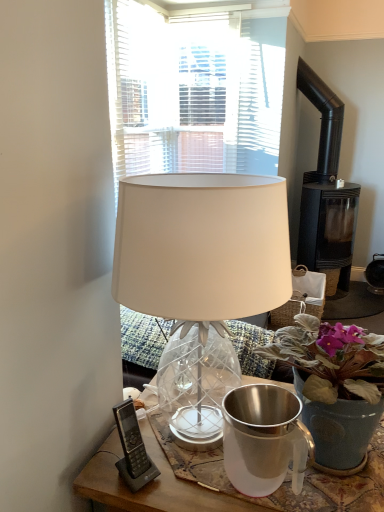
Question: Is black matte fireplace at right placed right next to white glass lamp at center?

Choices:
 (A) yes
 (B) no

Answer: (B)

Question: Is black matte fireplace at right positioned far away from white glass lamp at center?

Choices:
 (A) yes
 (B) no

Answer: (A)

Question: Is black matte fireplace at right facing towards white glass lamp at center?

Choices:
 (A) yes
 (B) no

Answer: (A)

Question: Is black matte fireplace at right positioned with its back to white glass lamp at center?

Choices:
 (A) no
 (B) yes

Answer: (A)

Question: Does black matte fireplace at right lie in front of white glass lamp at center?

Choices:
 (A) no
 (B) yes

Answer: (A)

Question: From a real-world perspective, is black matte fireplace at right on top of white glass lamp at center?

Choices:
 (A) yes
 (B) no

Answer: (B)

Question: Would you say shiny metallic jug at center is outside white glass lamp at center?

Choices:
 (A) yes
 (B) no

Answer: (B)

Question: From a real-world perspective, is shiny metallic jug at center positioned under white glass lamp at center based on gravity?

Choices:
 (A) yes
 (B) no

Answer: (A)

Question: Is the position of shiny metallic jug at center less distant than that of white glass lamp at center?

Choices:
 (A) no
 (B) yes

Answer: (A)

Question: Considering the relative positions of shiny metallic jug at center and white glass lamp at center in the image provided, is shiny metallic jug at center to the right of white glass lamp at center from the viewer's perspective?

Choices:
 (A) yes
 (B) no

Answer: (A)

Question: Does shiny metallic jug at center appear on the left side of white glass lamp at center?

Choices:
 (A) no
 (B) yes

Answer: (A)

Question: Considering the relative positions of shiny metallic jug at center and white glass lamp at center in the image provided, is shiny metallic jug at center behind white glass lamp at center?

Choices:
 (A) yes
 (B) no

Answer: (A)

Question: Can you confirm if black matte fireplace at right is smaller than matte blue pot at center?

Choices:
 (A) no
 (B) yes

Answer: (A)